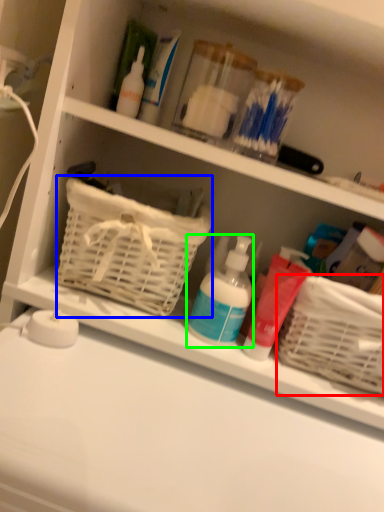
Question: Based on their relative distances, which object is farther from basket (highlighted by a red box)? Choose from basket (highlighted by a blue box) and cleaning product (highlighted by a green box).

Choices:
 (A) basket
 (B) cleaning product

Answer: (A)